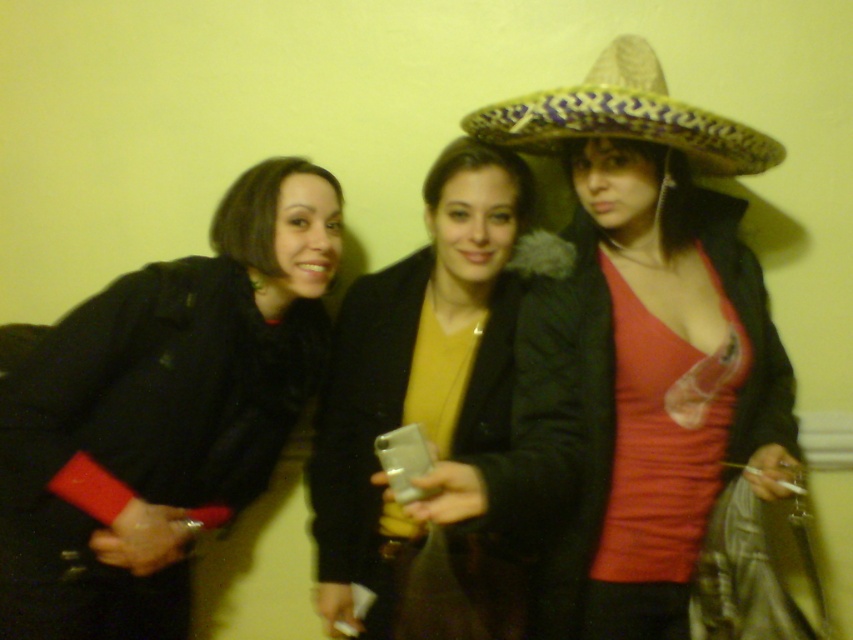
Looking at this image, who is higher up, black fuzzy coat at left or multicolored woven sombrero at center?

multicolored woven sombrero at center

Is black fuzzy coat at left closer to the viewer compared to multicolored woven sombrero at center?

No, black fuzzy coat at left is further to the viewer.

I want to click on black fuzzy coat at left, so coord(164,408).

At what (x,y) coordinates should I click in order to perform the action: click on black fuzzy coat at left. Please return your answer as a coordinate pair (x, y). The width and height of the screenshot is (853, 640). Looking at the image, I should click on (164, 408).